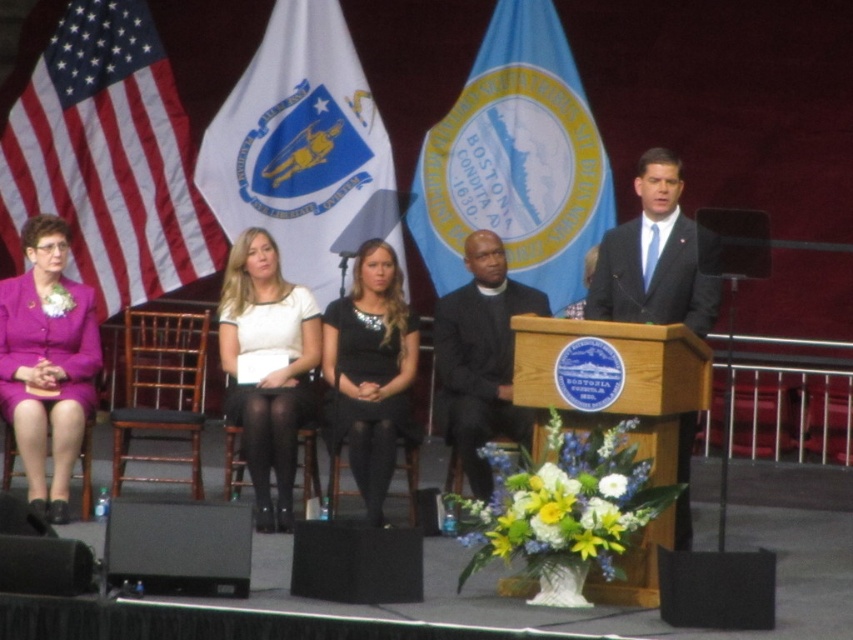
Looking at this image, you are organizing a stage setup for an event. You need to ensure that the blue fabric flag at center and the black matte speaker at lower center are visible to the audience. Given their sizes, which object should be placed higher to maintain visibility?

The blue fabric flag at center is bigger than the black matte speaker at lower center, so to maintain visibility, the blue fabric flag at center should be placed higher since its larger size can be seen from a distance more effectively.

You are attending a formal event and notice the blue fabric flag at center and the purple satin suit at left. From your perspective as an audience member, which object is positioned to the left?

The purple satin suit at left is positioned to the left of the blue fabric flag at center.

You are a stagehand preparing to move a 16 inch wide equipment cart through the space between the black matte speaker at lower left and the black leather chair at lower left. Can the cart fit through the gap between them?

The black matte speaker at lower left and black leather chair at lower left are 16.21 inches apart, so the 16 inch wide equipment cart can fit through the gap between them since it is slightly narrower than the space available.